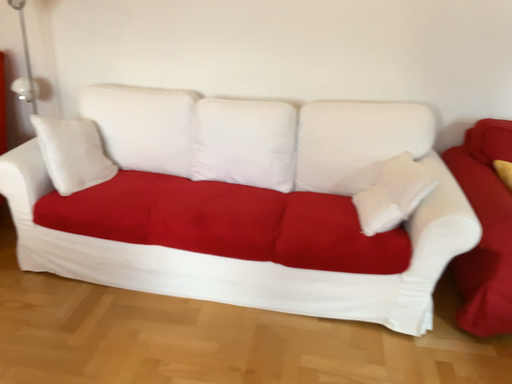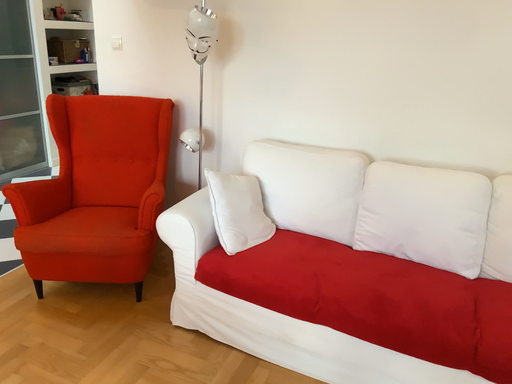
Question: How did the camera likely rotate when shooting the video?

Choices:
 (A) rotated upward
 (B) rotated downward

Answer: (A)